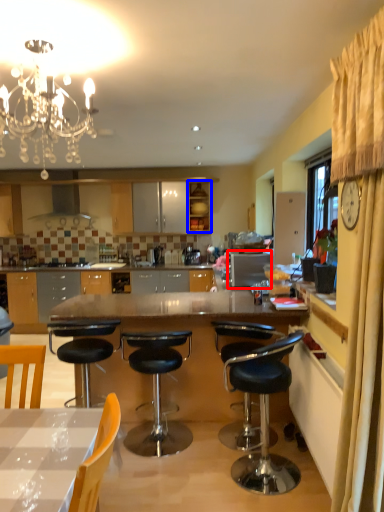
Question: Among these objects, which one is farthest to the camera, appliance (highlighted by a red box) or cabinetry (highlighted by a blue box)?

Choices:
 (A) appliance
 (B) cabinetry

Answer: (B)